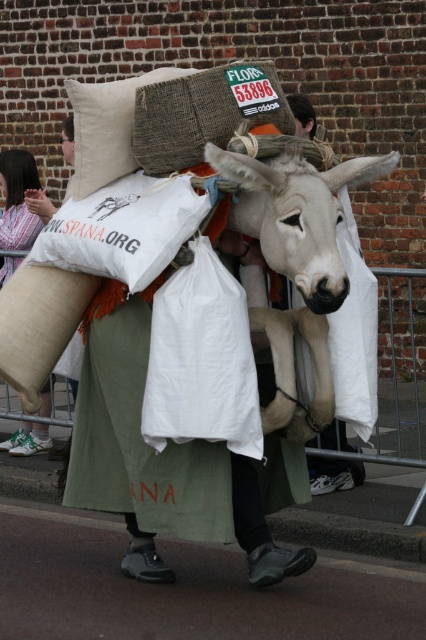
Question: Among these objects, which one is nearest to the camera?

Choices:
 (A) beige fabric pillow at upper left
 (B) white matte donkey at center

Answer: (B)

Question: In this image, where is white matte donkey at center located relative to beige fabric pillow at upper left?

Choices:
 (A) above
 (B) below

Answer: (B)

Question: Can you confirm if white matte donkey at center is positioned to the right of beige fabric pillow at upper left?

Choices:
 (A) yes
 (B) no

Answer: (A)

Question: Which object is closer to the camera taking this photo?

Choices:
 (A) beige fabric pillow at upper left
 (B) white matte donkey at center

Answer: (B)

Question: Does white matte donkey at center appear on the left side of beige fabric pillow at upper left?

Choices:
 (A) no
 (B) yes

Answer: (A)